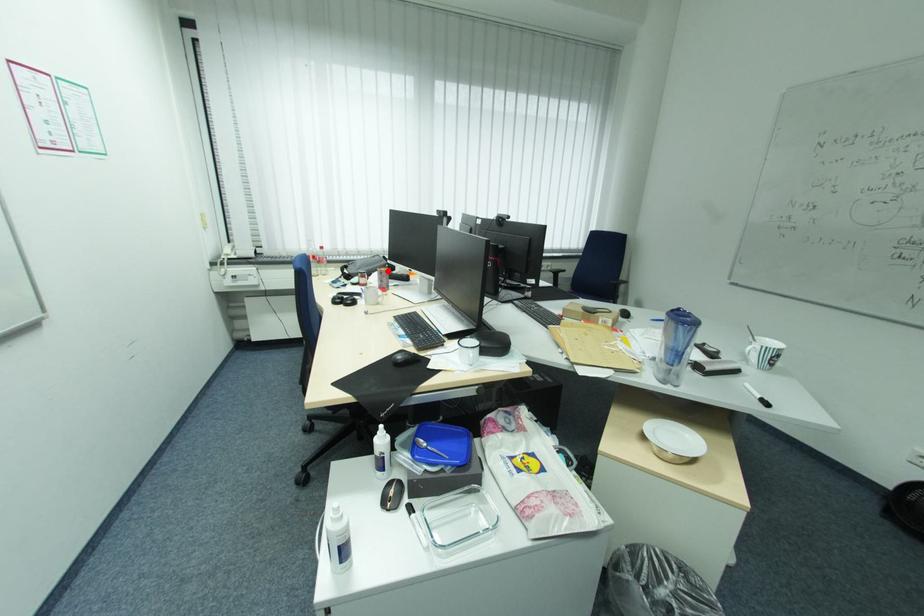
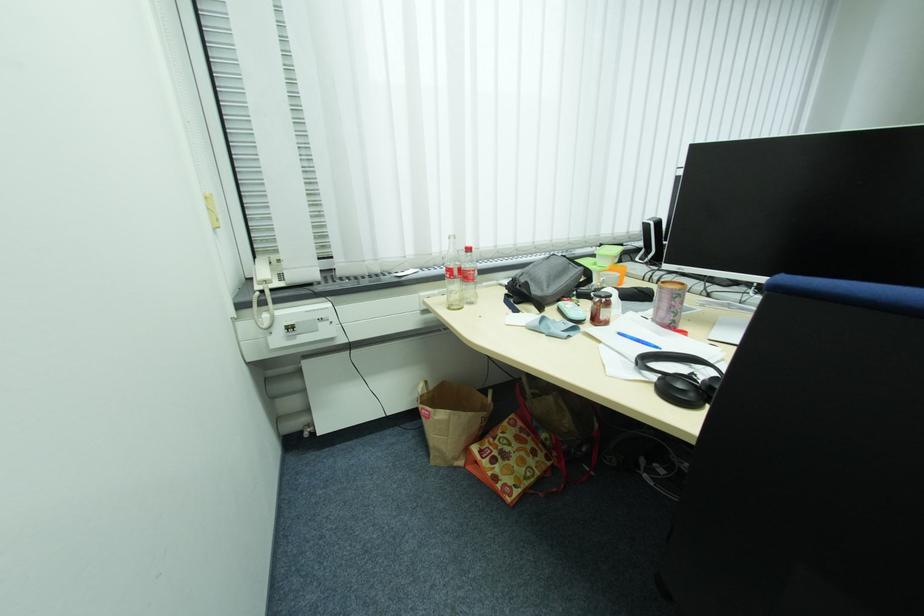
In the second image, find the point that corresponds to the highlighted location in the first image.

(687, 290)